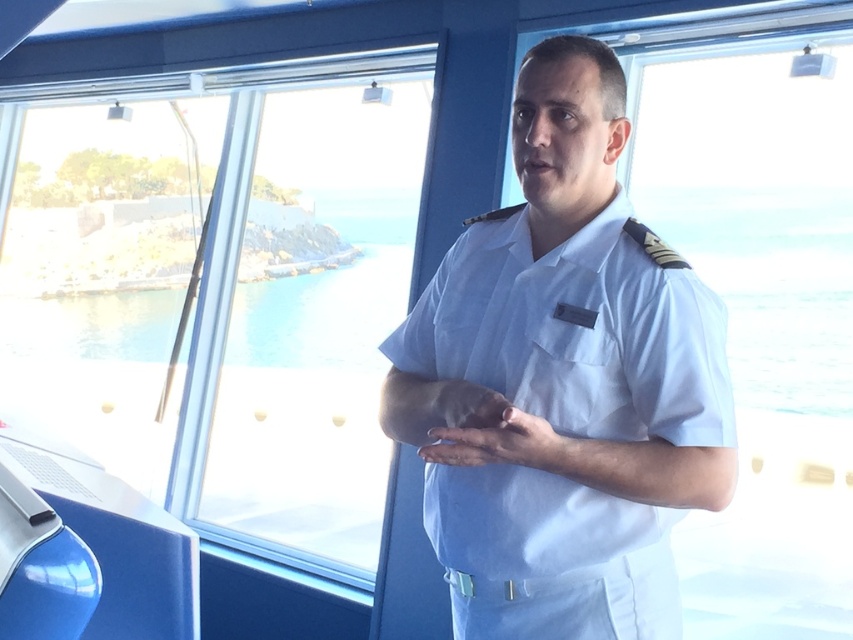
Which is behind, point (560, 369) or point (247, 260)?

Point (247, 260)

Locate an element on the screen. white cotton shirt at center is located at coordinates (577, 333).